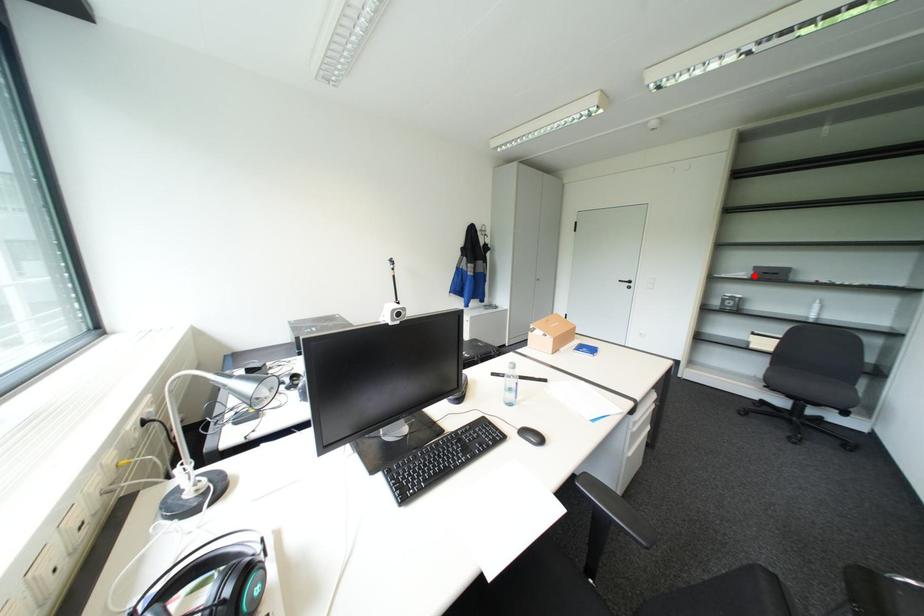
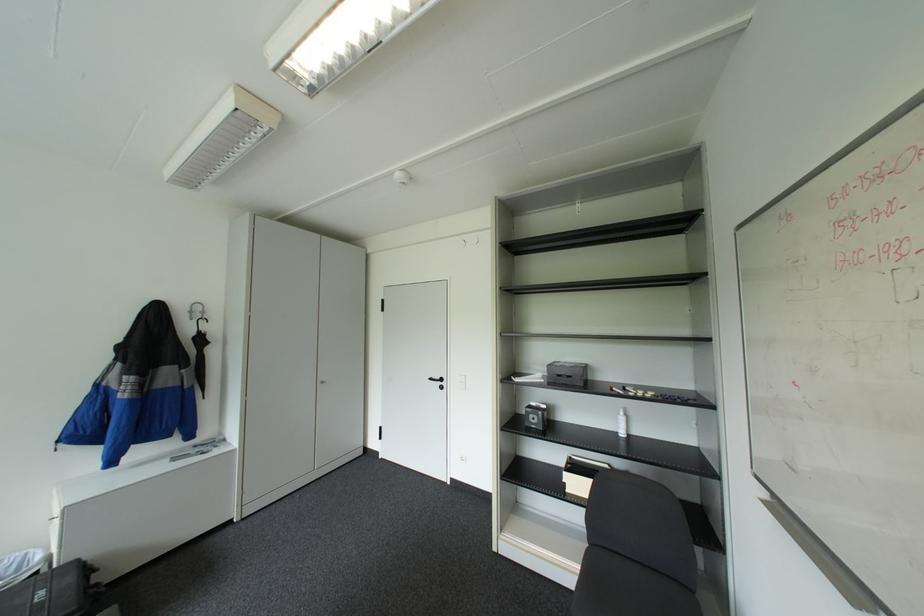
Locate, in the second image, the point that corresponds to the highlighted location in the first image.

(551, 379)